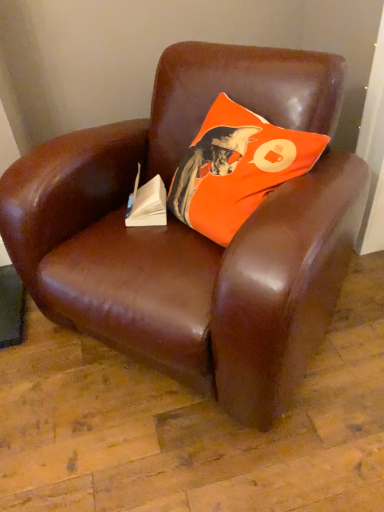
Question: Is orange fabric pillow at upper center positioned beyond the bounds of brown leather chair at center?

Choices:
 (A) no
 (B) yes

Answer: (A)

Question: Is orange fabric pillow at upper center aimed at brown leather chair at center?

Choices:
 (A) yes
 (B) no

Answer: (A)

Question: From the image's perspective, is orange fabric pillow at upper center above brown leather chair at center?

Choices:
 (A) no
 (B) yes

Answer: (B)

Question: Is orange fabric pillow at upper center far from brown leather chair at center?

Choices:
 (A) yes
 (B) no

Answer: (B)

Question: Considering the relative sizes of orange fabric pillow at upper center and brown leather chair at center in the image provided, is orange fabric pillow at upper center taller than brown leather chair at center?

Choices:
 (A) no
 (B) yes

Answer: (A)

Question: Which is correct: orange fabric pillow at upper center is inside brown leather chair at center, or outside of it?

Choices:
 (A) inside
 (B) outside

Answer: (A)

Question: From the image's perspective, is orange fabric pillow at upper center above or below brown leather chair at center?

Choices:
 (A) above
 (B) below

Answer: (A)

Question: Is orange fabric pillow at upper center wider or thinner than brown leather chair at center?

Choices:
 (A) wide
 (B) thin

Answer: (B)

Question: Relative to brown leather chair at center, is orange fabric pillow at upper center in front or behind?

Choices:
 (A) front
 (B) behind

Answer: (B)

Question: Based on their sizes in the image, would you say white paper at center is bigger or smaller than orange fabric pillow at upper center?

Choices:
 (A) small
 (B) big

Answer: (A)

Question: Would you say white paper at center is to the left or to the right of orange fabric pillow at upper center in the picture?

Choices:
 (A) left
 (B) right

Answer: (A)

Question: From the image's perspective, is white paper at center located above or below orange fabric pillow at upper center?

Choices:
 (A) above
 (B) below

Answer: (B)

Question: Considering the positions of white paper at center and orange fabric pillow at upper center in the image, is white paper at center taller or shorter than orange fabric pillow at upper center?

Choices:
 (A) tall
 (B) short

Answer: (B)

Question: From a real-world perspective, is brown leather chair at center above or below orange fabric pillow at upper center?

Choices:
 (A) above
 (B) below

Answer: (B)

Question: In terms of width, does brown leather chair at center look wider or thinner when compared to orange fabric pillow at upper center?

Choices:
 (A) thin
 (B) wide

Answer: (B)